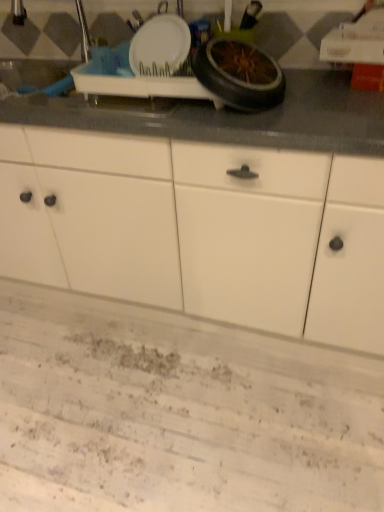
Question: From a real-world perspective, is white matte cabinet at center above or below black rubber wheel at upper center?

Choices:
 (A) above
 (B) below

Answer: (B)

Question: Relative to black rubber wheel at upper center, is white matte cabinet at center in front or behind?

Choices:
 (A) front
 (B) behind

Answer: (A)

Question: Is white matte cabinet at center wider or thinner than black rubber wheel at upper center?

Choices:
 (A) thin
 (B) wide

Answer: (B)

Question: Is black rubber wheel at upper center wider or thinner than white matte cabinet at center?

Choices:
 (A) thin
 (B) wide

Answer: (A)

Question: Is point (248, 105) closer or farther from the camera than point (170, 147)?

Choices:
 (A) closer
 (B) farther

Answer: (A)

Question: In the image, is black rubber wheel at upper center positioned in front of or behind white matte cabinet at center?

Choices:
 (A) behind
 (B) front

Answer: (A)

Question: From the image's perspective, is black rubber wheel at upper center above or below white matte cabinet at center?

Choices:
 (A) above
 (B) below

Answer: (A)